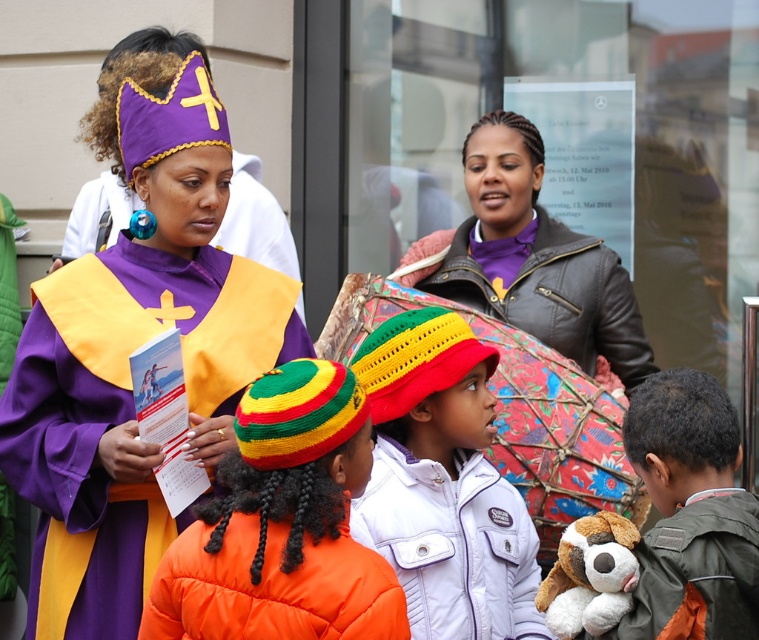
Question: Where is purple matte/cloth hat at upper left located in relation to soft plush toy at center in the image?

Choices:
 (A) above
 (B) below

Answer: (A)

Question: In this image, where is purple leather jacket at upper center located relative to soft plush toy at center?

Choices:
 (A) left
 (B) right

Answer: (B)

Question: Based on their relative distances, which object is farther from the purple matte/cloth hat at upper left?

Choices:
 (A) soft plush toy at center
 (B) purple leather jacket at upper center
 (C) knitted woolen hat at center
 (D) purple velvet crown at upper left

Answer: (B)

Question: Which of these objects is positioned farthest from the purple velvet crown at upper left?

Choices:
 (A) purple leather jacket at upper center
 (B) soft plush toy at center

Answer: (B)

Question: Which point is farther to the camera?

Choices:
 (A) (698, 637)
 (B) (502, 131)

Answer: (B)

Question: Can you confirm if purple matte/cloth hat at upper left is wider than purple leather jacket at upper center?

Choices:
 (A) no
 (B) yes

Answer: (A)